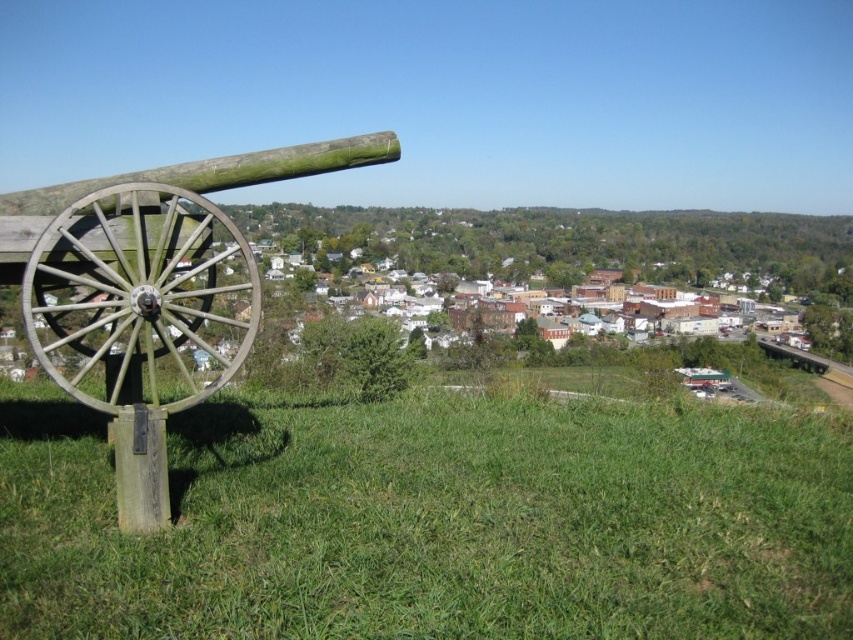
You are a historian examining the scene. You need to determine the spatial relationship between the green grassy field at lower left and the green wood cannon at left. Which object is located below the other?

The green grassy field at lower left is positioned under green wood cannon at left, meaning the field is below the cannon.

You are standing at the base of the slope where the wooden cannon is mounted. You want to walk to the point marked at coordinates point (688, 401). However, there is an obstacle at point (39, 317). Can you see the destination point through the obstacle?

Point (688, 401) is behind point (39, 317), so the obstacle at point (39, 317) would block your view of the destination point (688, 401).